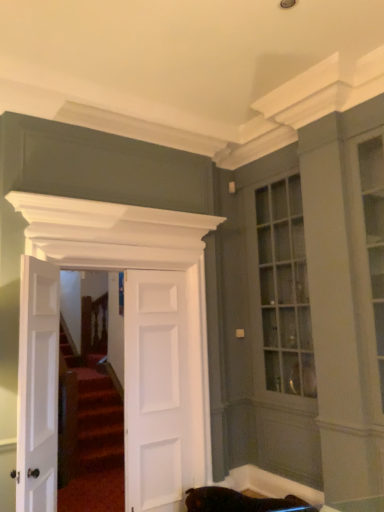
Question: From the image's perspective, is white matte door at left, the 3th door when ordered from right to left, positioned above or below white matte door at center, the 2th door positioned from the right?

Choices:
 (A) below
 (B) above

Answer: (B)

Question: Would you say white matte door at left, the 3th door when ordered from right to left, is inside or outside white matte door at center, which is counted as the 2th door, starting from the left?

Choices:
 (A) outside
 (B) inside

Answer: (A)

Question: Which is nearer to the white matte door at left, marked as the first door in a left-to-right arrangement?

Choices:
 (A) white matte door at center, arranged as the first door when viewed from the right
 (B) white matte door at center, the 2th door positioned from the right

Answer: (B)

Question: Considering the real-world distances, which object is farthest from the white matte door at center, the 2th door positioned from the right?

Choices:
 (A) white matte door at left, the 3th door when ordered from right to left
 (B) white matte door at center, arranged as the first door when viewed from the right

Answer: (A)